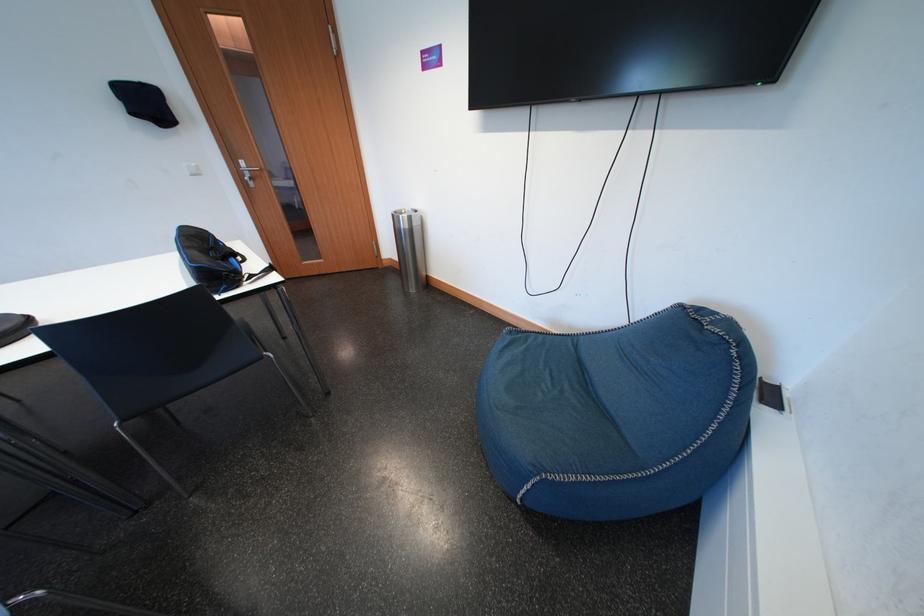
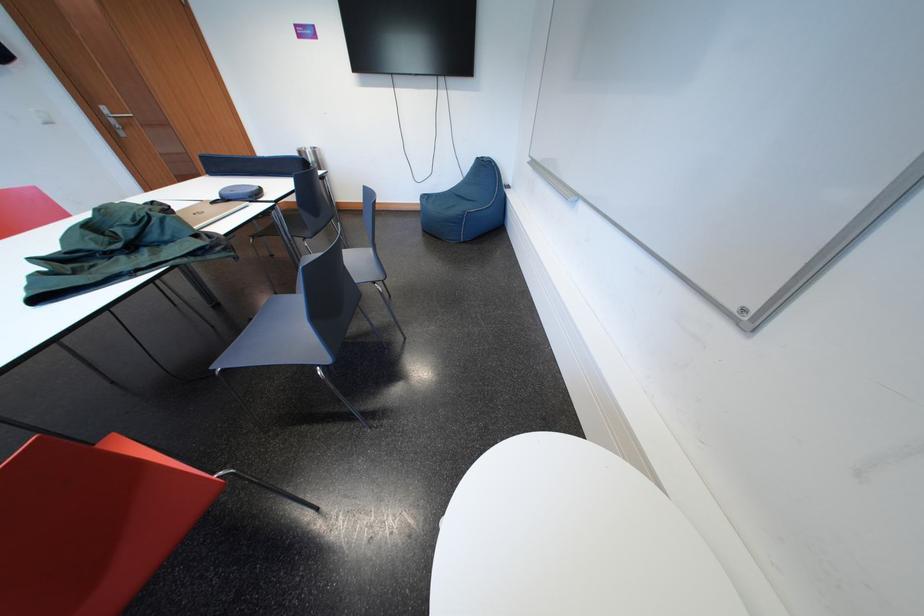
Where in the second image is the point corresponding to point 660,308 from the first image?

(477, 169)